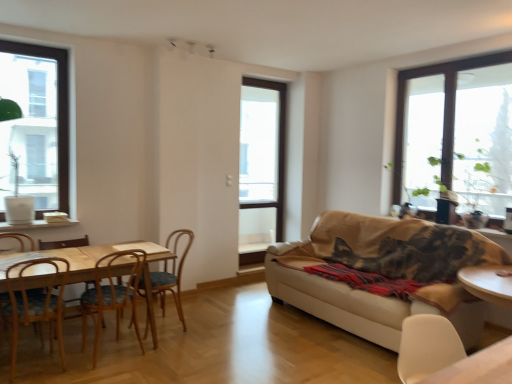
Question: Visually, is green leafy plant at right positioned to the left or to the right of white matte chair at lower right, which is the fifth chair in back-to-front order?

Choices:
 (A) right
 (B) left

Answer: (A)

Question: From a real-world perspective, is green leafy plant at right positioned above or below white matte chair at lower right, which is the fifth chair in left-to-right order?

Choices:
 (A) above
 (B) below

Answer: (A)

Question: Which object is the farthest from the white wood window sill at left?

Choices:
 (A) green leafy plant at right
 (B) wooden chair at left, which is the 2th chair from back to front
 (C) clear glass window at left, which appears as the 2th window when viewed from the back
 (D) white matte chair at lower right, which is the fifth chair in back-to-front order
 (E) beige fabric couch at lower right

Answer: (C)

Question: Estimate the real-world distances between objects in this image. Which object is closer to the wooden table at left?

Choices:
 (A) beige fabric couch at lower right
 (B) white wood window sill at left
 (C) wooden chair at left, which is the fifth chair from right to left
 (D) transparent glass window at upper right, which ranks as the 3th window in left-to-right order
 (E) wooden chair at left, the second chair positioned from the front

Answer: (E)